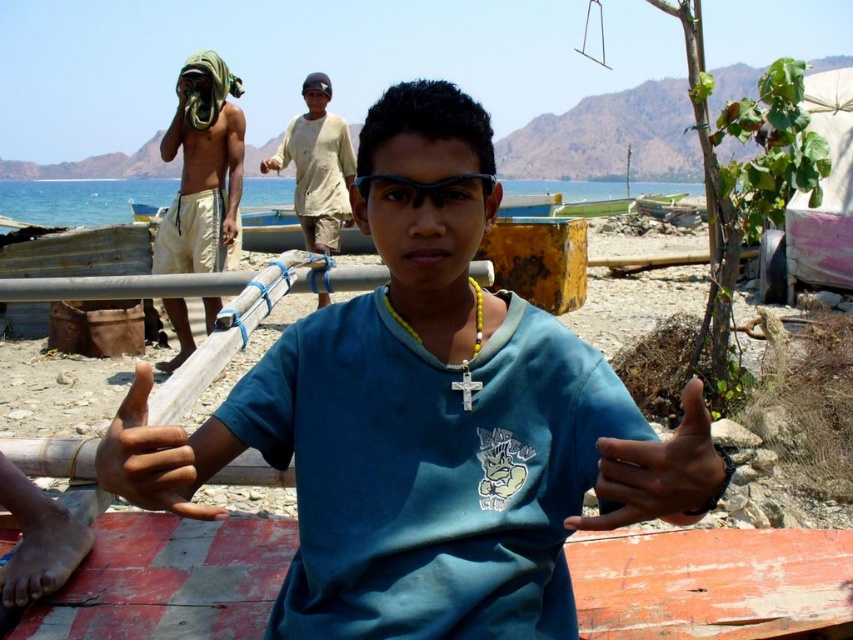
You are a photographer trying to capture a candid shot of the light beige cotton shirt at center. However, the dark skin hand at center is blocking your view. Can you adjust your position to the left or right to avoid the obstruction?

The dark skin hand at center is on the right side of the light beige cotton shirt at center, so moving to the left would allow you to avoid the obstruction caused by the dark skin hand at center.

You are a photographer trying to capture a candid shot of the blue cotton shirt at center and the brown leather hand at center. Your camera has a minimum focus distance of 12 inches. Will you be able to focus on both subjects without moving closer?

The blue cotton shirt at center is 11.25 inches away from the brown leather hand at center, which is within the camera minimum focus distance of 12 inches. Therefore, the camera can focus on both subjects without moving closer.

You are a photographer trying to capture a closeup of the hands in the scene. Which hand, the dark skin hand at center or the brown leather hand at center, should you focus on to ensure it appears larger in your photo?

The dark skin hand at center is closer to the viewer than the brown leather hand at center, so focusing on it will make it appear larger in the photo.